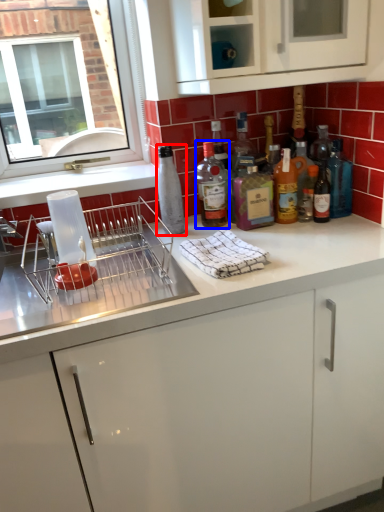
Question: Among these objects, which one is farthest to the camera, bottle (highlighted by a red box) or bottle (highlighted by a blue box)?

Choices:
 (A) bottle
 (B) bottle

Answer: (B)